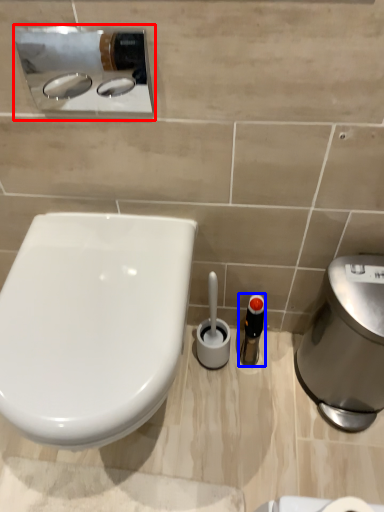
Question: Which of the following is the farthest to the observer, sink (highlighted by a red box) or toiletry (highlighted by a blue box)?

Choices:
 (A) sink
 (B) toiletry

Answer: (B)